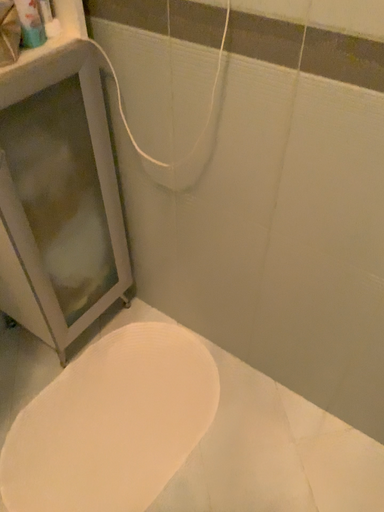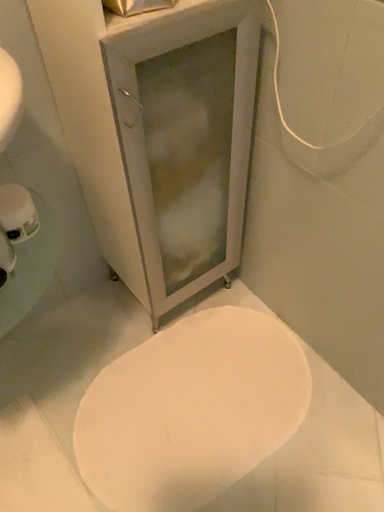
Question: How did the camera likely rotate when shooting the video?

Choices:
 (A) rotated right
 (B) rotated left

Answer: (B)